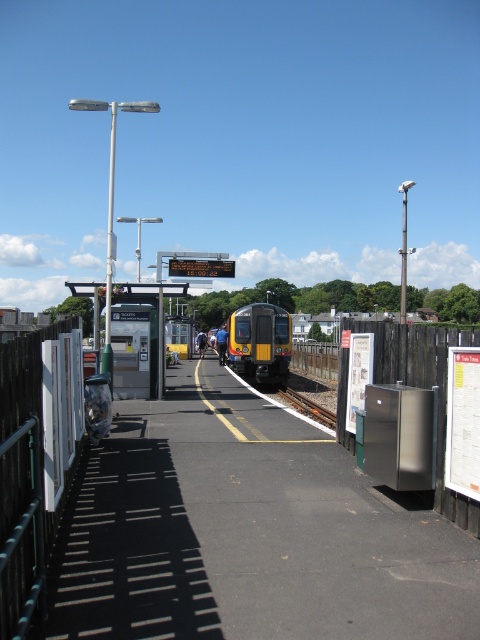
You are a passenger waiting at the train station. You notice the yellow matte train at center and the brown wooden train track at center. Which object takes up more space in the image?

The yellow matte train at center is bigger than the brown wooden train track at center, so it takes up more space in the image.

You are a passenger waiting on the platform and see the yellow matte train at center approaching. Based on its current position coordinates, can you estimate how much time remains before the train arrives at the platform?

The yellow matte train at center is positioned at coordinates point (x=261, y=340), which indicates it is still some distance away from the platform. However, without knowing the speed or distance scale, an exact time cannot be determined.